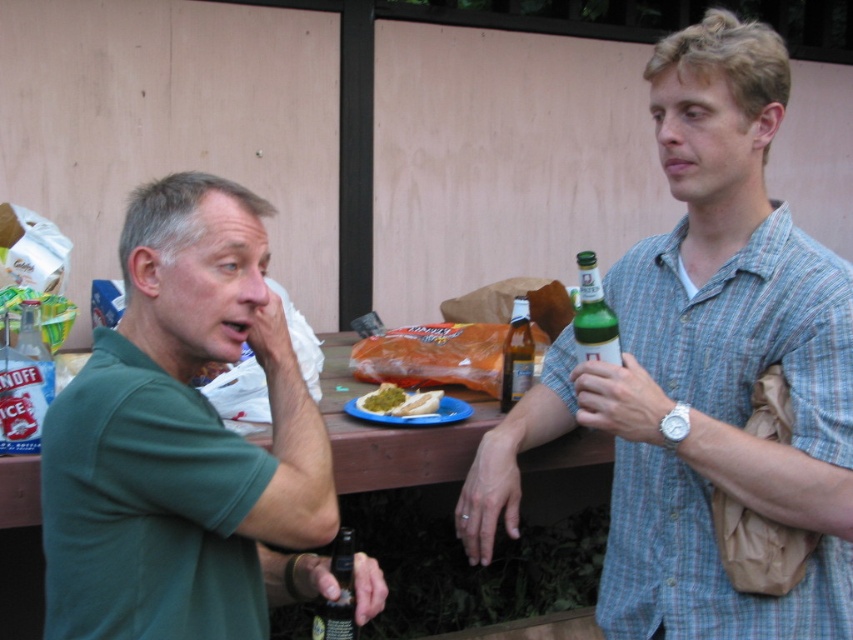
You are a photographer trying to capture a candid shot of the green cotton shirt at center and the green glass bottle at right. Since both are green, you want to ensure you frame them properly. Based on their positions, which object should you focus on first if you want to capture both in the same frame without moving the camera?

The green cotton shirt at center is located below the green glass bottle at right, so you should focus on the green glass bottle at right first as it is higher up in the frame, allowing the shirt to be captured below it within the same shot.

You are planning to place a small decorative item on the table between the green matte shirt at left and the green glass bottle at center. Based on their widths, which object should you position closer to the edge of the table to ensure the item fits?

The green matte shirt at left might be wider than the green glass bottle at center, so positioning the green glass bottle at center closer to the edge would leave more space for the decorative item between them.